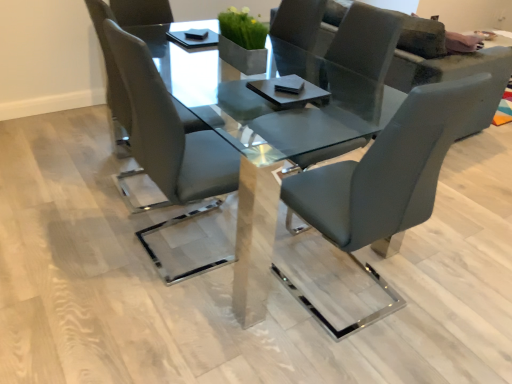
Question: Should I look upward or downward to see matte gray chair at center, which is the 2th chair in left-to-right order?

Choices:
 (A) up
 (B) down

Answer: (A)

Question: From a real-world perspective, is matte gray chair at center, which appears as the 2th chair when viewed from the right, over satin grey leather chair at center, marked as the 3th chair in a right-to-left arrangement?

Choices:
 (A) yes
 (B) no

Answer: (A)

Question: Does matte gray chair at center, which is the 2th chair in left-to-right order, have a lesser width compared to satin grey leather chair at center, marked as the 3th chair in a right-to-left arrangement?

Choices:
 (A) no
 (B) yes

Answer: (A)

Question: From the image's perspective, is matte gray chair at center, which appears as the 2th chair when viewed from the right, located above satin grey leather chair at center, which is counted as the first chair, starting from the left?

Choices:
 (A) no
 (B) yes

Answer: (A)

Question: Is matte gray chair at center, which is the 2th chair in left-to-right order, looking in the opposite direction of satin grey leather chair at center, marked as the 3th chair in a right-to-left arrangement?

Choices:
 (A) no
 (B) yes

Answer: (A)

Question: Would you say matte gray chair at center, which appears as the 2th chair when viewed from the right, contains satin grey leather chair at center, marked as the 3th chair in a right-to-left arrangement?

Choices:
 (A) no
 (B) yes

Answer: (A)

Question: Is the position of matte gray chair at center, which appears as the 2th chair when viewed from the right, more distant than that of satin grey leather chair at center, which is counted as the first chair, starting from the left?

Choices:
 (A) no
 (B) yes

Answer: (A)

Question: Can you see matte gray chair at center, placed as the 1th chair when sorted from right to left, touching clear glass table at center?

Choices:
 (A) yes
 (B) no

Answer: (B)

Question: Considering the relative positions of matte gray chair at center, placed as the 1th chair when sorted from right to left, and clear glass table at center in the image provided, is matte gray chair at center, placed as the 1th chair when sorted from right to left, to the right of clear glass table at center from the viewer's perspective?

Choices:
 (A) no
 (B) yes

Answer: (B)

Question: From a real-world perspective, does matte gray chair at center, arranged as the third chair when viewed from the left, sit lower than clear glass table at center?

Choices:
 (A) no
 (B) yes

Answer: (A)

Question: Can you confirm if matte gray chair at center, placed as the 1th chair when sorted from right to left, is smaller than clear glass table at center?

Choices:
 (A) yes
 (B) no

Answer: (A)

Question: From the image's perspective, is matte gray chair at center, arranged as the third chair when viewed from the left, on clear glass table at center?

Choices:
 (A) no
 (B) yes

Answer: (A)

Question: Considering the relative positions of matte gray chair at center, arranged as the third chair when viewed from the left, and clear glass table at center in the image provided, is matte gray chair at center, arranged as the third chair when viewed from the left, behind clear glass table at center?

Choices:
 (A) no
 (B) yes

Answer: (A)

Question: Does satin grey leather chair at center, which is counted as the first chair, starting from the left, appear on the right side of matte gray chair at center, which is the 2th chair in left-to-right order?

Choices:
 (A) yes
 (B) no

Answer: (B)